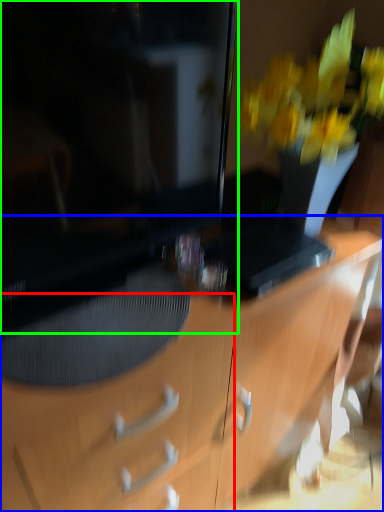
Question: Which object is positioned closest to drawer (highlighted by a red box)? Select from desk (highlighted by a blue box) and television (highlighted by a green box).

Choices:
 (A) desk
 (B) television

Answer: (A)